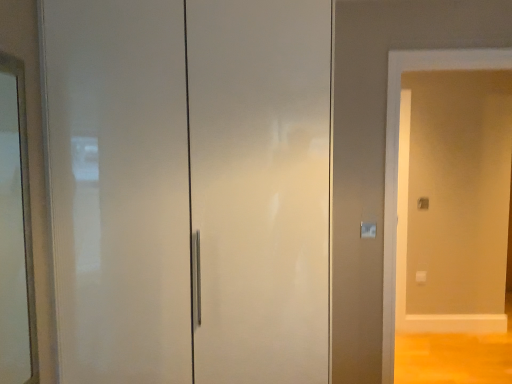
Question: From a real-world perspective, relative to matte white screen door at right, is clear glass mirror at left vertically above or below?

Choices:
 (A) above
 (B) below

Answer: (A)

Question: Is clear glass mirror at left wider or thinner than matte white screen door at right?

Choices:
 (A) wide
 (B) thin

Answer: (B)

Question: Estimate the real-world distances between objects in this image. Which object is farther from the matte white screen door at right?

Choices:
 (A) clear glass mirror at left
 (B) white glossy door at center

Answer: (A)

Question: Which of these objects is positioned closest to the matte white screen door at right?

Choices:
 (A) white glossy door at center
 (B) clear glass mirror at left

Answer: (A)